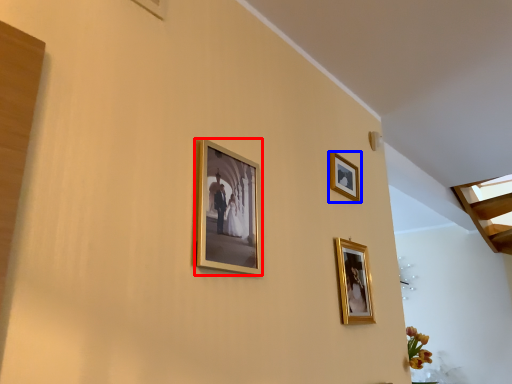
Question: Which point is closer to the camera, picture frame (highlighted by a red box) or picture frame (highlighted by a blue box)?

Choices:
 (A) picture frame
 (B) picture frame

Answer: (A)